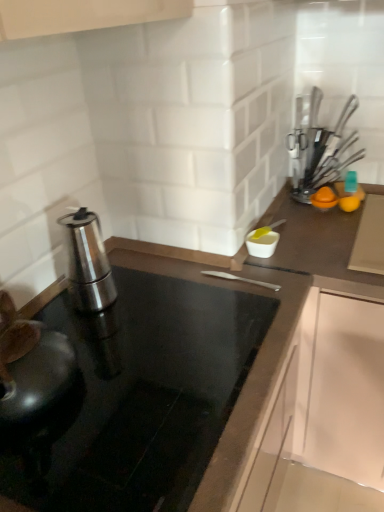
Find the location of a particular element. Image resolution: width=384 pixels, height=512 pixels. vacant area to the right of polished stainless steel espresso maker at left, the second kitchen appliance viewed from the right is located at coordinates (164, 301).